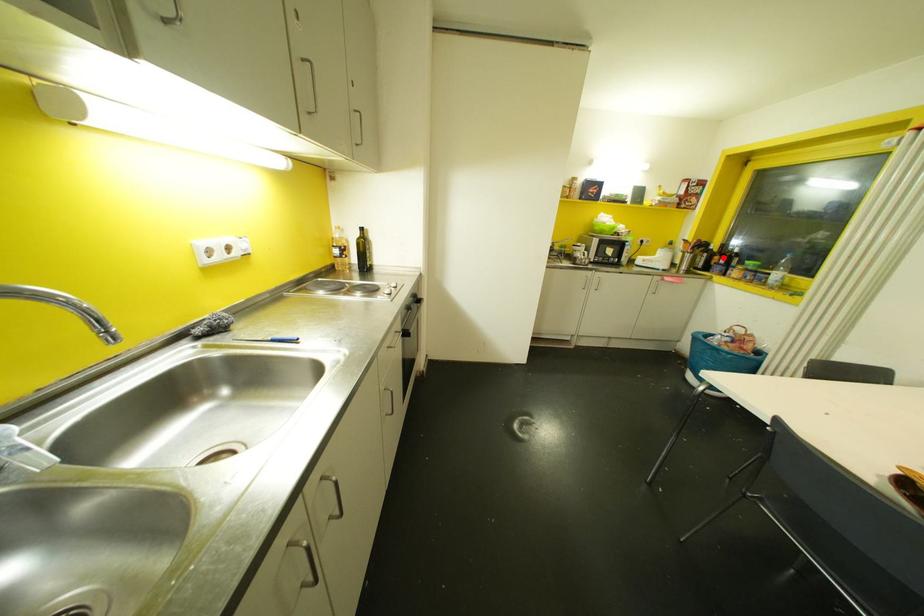
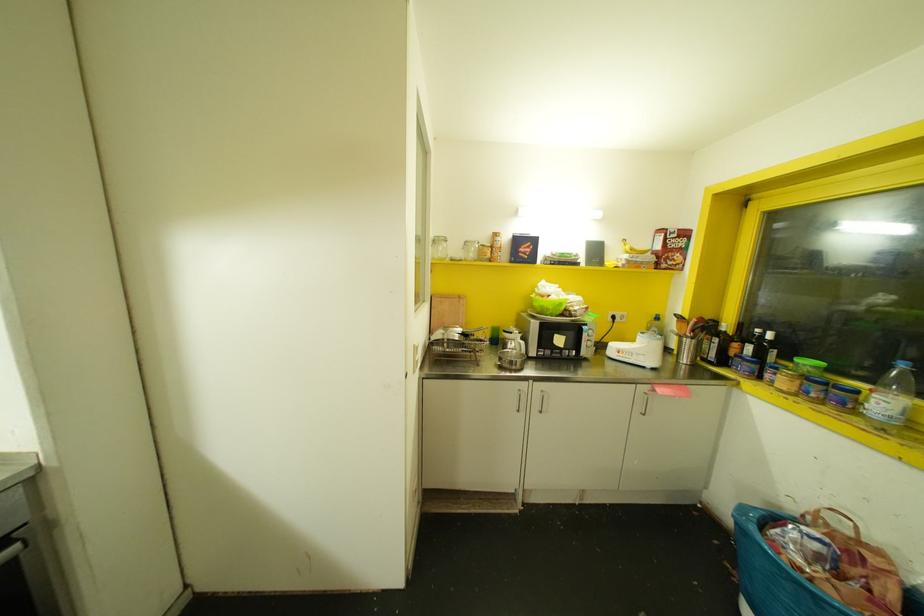
The point at the highlighted location is marked in the first image. Where is the corresponding point in the second image?

(748, 347)